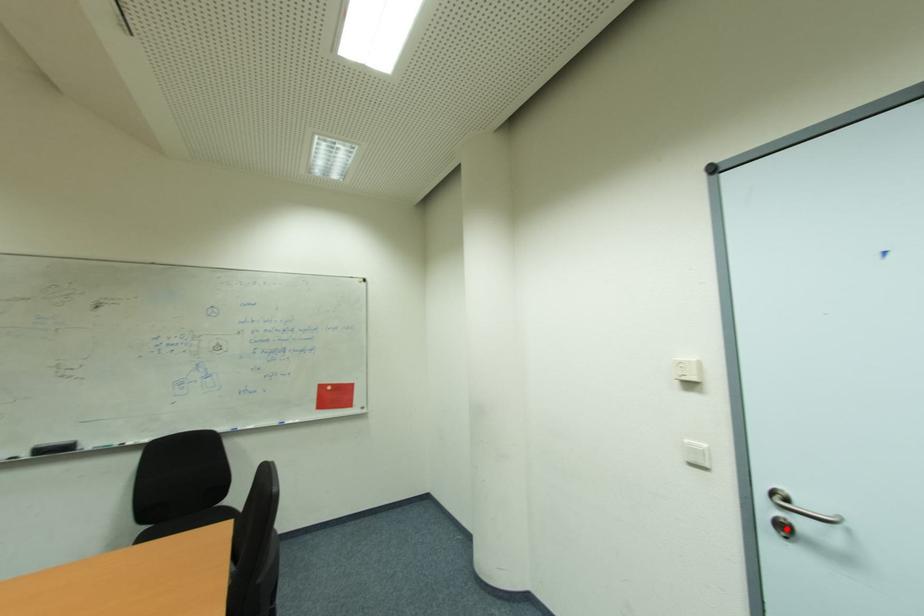
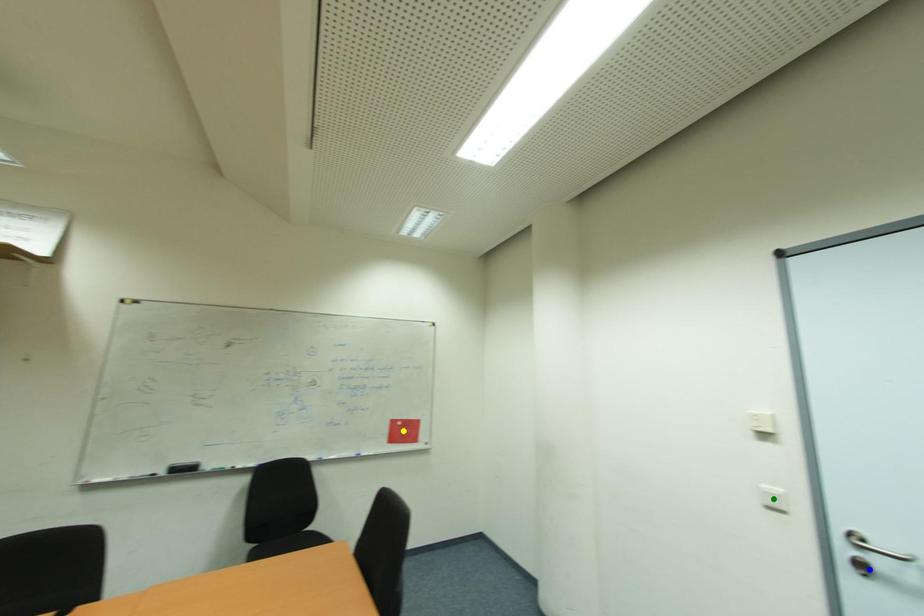
Question: I am providing you with two images of the same scene from different viewpoints. A red point is marked on the first image. You are given multiple points on the second image. Which spot in image 2 lines up with the point in image 1?

Choices:
 (A) blue point
 (B) yellow point
 (C) green point

Answer: (A)